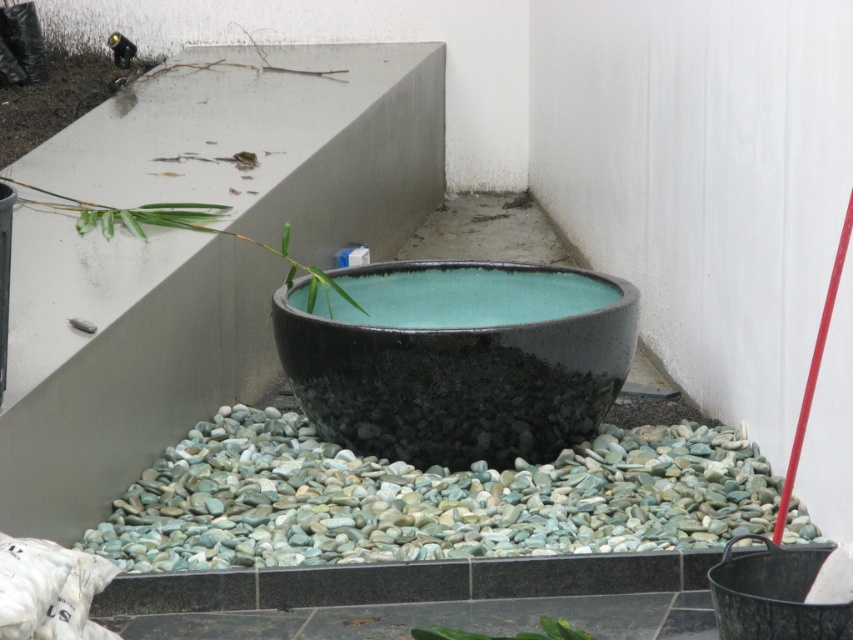
Question: Which of these objects is positioned farthest from the green leafy plant at upper left?

Choices:
 (A) black glossy bowl at center
 (B) green leafy plant at center

Answer: (B)

Question: Is the position of green leafy plant at upper left more distant than that of green leafy plant at center?

Choices:
 (A) no
 (B) yes

Answer: (B)

Question: Can you confirm if black glossy bowl at center is positioned below green leafy plant at center?

Choices:
 (A) no
 (B) yes

Answer: (A)

Question: Which of these objects is positioned farthest from the black glossy bowl at center?

Choices:
 (A) green leafy plant at upper left
 (B) green leafy plant at center

Answer: (B)

Question: Based on their relative distances, which object is nearer to the black glossy bowl at center?

Choices:
 (A) green leafy plant at upper left
 (B) green leafy plant at center

Answer: (A)

Question: Can you confirm if black glossy bowl at center is positioned to the right of green leafy plant at upper left?

Choices:
 (A) no
 (B) yes

Answer: (B)